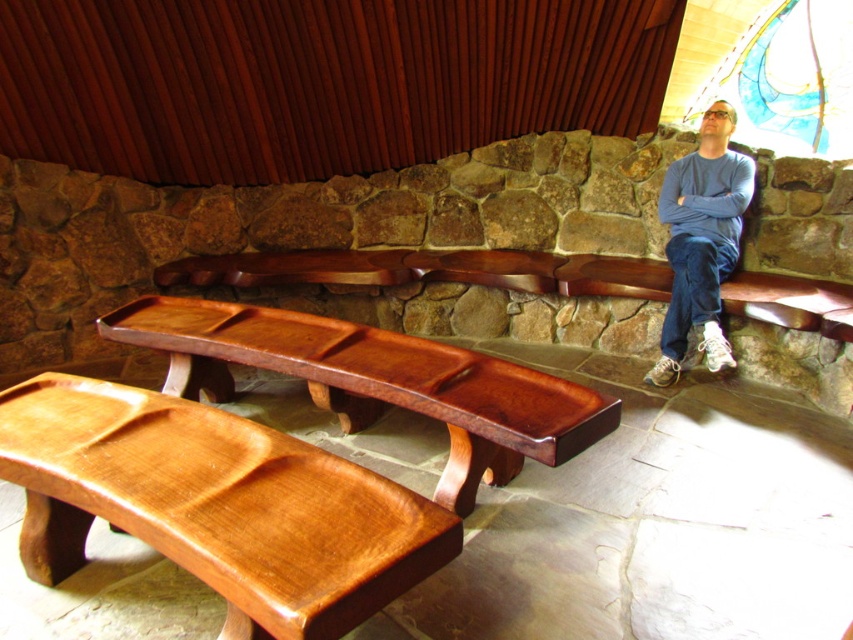
The image size is (853, 640). What do you see at coordinates (376, 381) in the screenshot? I see `satin wood bench at center` at bounding box center [376, 381].

Does satin wood bench at center have a smaller size compared to blue cotton shirt at right?

No.

Which is in front, point (329, 368) or point (706, 323)?

Point (329, 368) is in front.

You are a GUI agent. You are given a task and a screenshot of the screen. Output one action in this format:
    pyautogui.click(x=<x>, y=<y>)
    Task: Click on the satin wood bench at center
    Image resolution: width=853 pixels, height=640 pixels.
    Given the screenshot: What is the action you would take?
    pyautogui.click(x=376, y=381)

Is shiny brown wood bench at lower left to the right of satin wood bench at center from the viewer's perspective?

In fact, shiny brown wood bench at lower left is to the left of satin wood bench at center.

Does shiny brown wood bench at lower left have a lesser height compared to satin wood bench at center?

Correct, shiny brown wood bench at lower left is not as tall as satin wood bench at center.

Which is behind, point (152, 472) or point (178, 380)?

Point (178, 380)

Where is `shiny brown wood bench at lower left`? Image resolution: width=853 pixels, height=640 pixels. shiny brown wood bench at lower left is located at coordinates (215, 504).

Is shiny brown wood bench at lower left positioned behind blue cotton shirt at right?

No, shiny brown wood bench at lower left is closer to the viewer.

Which is below, shiny brown wood bench at lower left or blue cotton shirt at right?

shiny brown wood bench at lower left is below.

Describe the element at coordinates (215, 504) in the screenshot. I see `shiny brown wood bench at lower left` at that location.

The height and width of the screenshot is (640, 853). Identify the location of shiny brown wood bench at lower left. (215, 504).